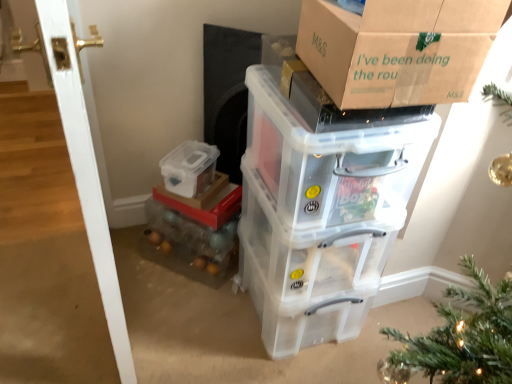
Question: Is white glossy door at left in front of or behind transparent plastic storage box at center, which is counted as the first storage box, starting from the bottom, in the image?

Choices:
 (A) behind
 (B) front

Answer: (B)

Question: Is white glossy door at left wider or thinner than transparent plastic storage box at center, which is the 4th storage box in top-to-bottom order?

Choices:
 (A) wide
 (B) thin

Answer: (B)

Question: Estimate the real-world distances between objects in this image. Which object is closer to the transparent plastic storage box at lower center, which ranks as the 3th storage box in bottom-to-top order?

Choices:
 (A) brown cardboard box at upper center
 (B) transparent plastic storage box at upper right, marked as the fourth storage box in a bottom-to-top arrangement
 (C) translucent plastic storage box at lower center, the third storage box viewed from the top
 (D) clear plastic microwave at center
 (E) white glossy door at left

Answer: (C)

Question: Estimate the real-world distances between objects in this image. Which object is farther from the transparent plastic storage box at lower center, which ranks as the 3th storage box in bottom-to-top order?

Choices:
 (A) white glossy door at left
 (B) translucent plastic storage box at lower center, the second storage box ordered from the bottom
 (C) brown cardboard box at upper center
 (D) clear plastic microwave at center
 (E) transparent plastic storage box at center, which is the 4th storage box in top-to-bottom order

Answer: (C)